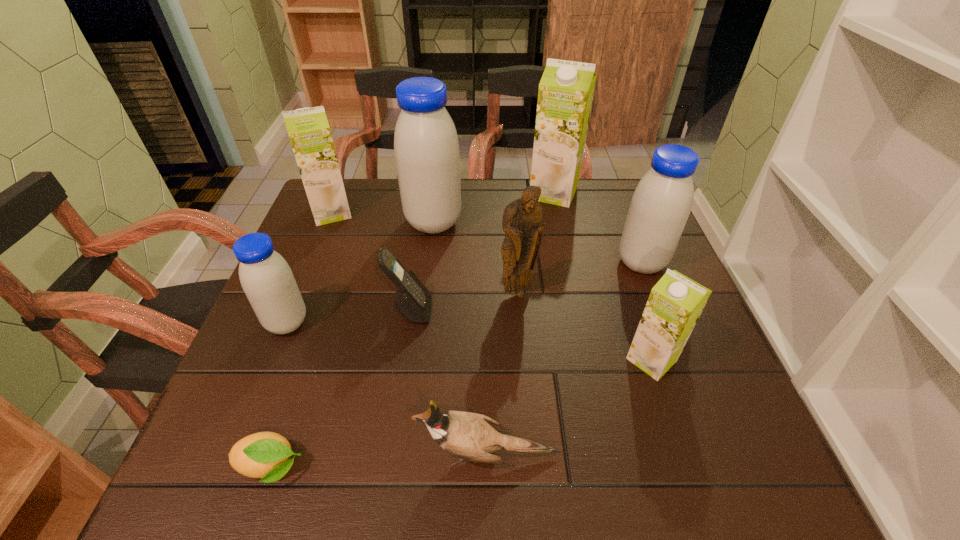
This screenshot has height=540, width=960. I want to click on object present at the near left corner, so click(266, 455).

Where is `vacant region at the far edge`? This screenshot has height=540, width=960. vacant region at the far edge is located at coordinates 465,220.

Find the location of a particular element. Image resolution: width=960 pixels, height=540 pixels. free spot at the near edge of the desktop is located at coordinates (421, 453).

Locate an element on the screen. The image size is (960, 540). free space at the left edge is located at coordinates (299, 358).

Locate an element on the screen. This screenshot has width=960, height=540. free location at the right edge is located at coordinates (707, 369).

Image resolution: width=960 pixels, height=540 pixels. I want to click on vacant space at the far left corner of the desktop, so click(357, 208).

Locate an element on the screen. This screenshot has width=960, height=540. blank space at the far right corner of the desktop is located at coordinates pos(595,184).

You are a GUI agent. You are given a task and a screenshot of the screen. Output one action in this format:
    pyautogui.click(x=<x>, y=<y>)
    Task: Click on the free space that is in between the smallest blue soya milk and the biggest green soya milk
    The width and height of the screenshot is (960, 540).
    Given the screenshot: What is the action you would take?
    [420, 258]

Locate an element on the screen. The image size is (960, 540). vacant area between the leftmost green soya milk and the nearest green soya milk is located at coordinates (492, 286).

Where is `vacant region between the second smallest green soya milk and the figurine`? The width and height of the screenshot is (960, 540). vacant region between the second smallest green soya milk and the figurine is located at coordinates tap(424, 253).